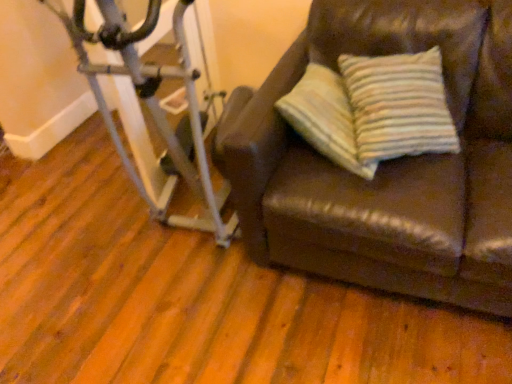
Question: Considering the relative sizes of brown leather couch at right and silver metallic stationary bicycle at left in the image provided, is brown leather couch at right bigger than silver metallic stationary bicycle at left?

Choices:
 (A) yes
 (B) no

Answer: (A)

Question: Is brown leather couch at right oriented towards silver metallic stationary bicycle at left?

Choices:
 (A) yes
 (B) no

Answer: (B)

Question: Is brown leather couch at right completely or partially outside of silver metallic stationary bicycle at left?

Choices:
 (A) yes
 (B) no

Answer: (A)

Question: Considering the relative sizes of brown leather couch at right and silver metallic stationary bicycle at left in the image provided, is brown leather couch at right thinner than silver metallic stationary bicycle at left?

Choices:
 (A) no
 (B) yes

Answer: (B)

Question: Is silver metallic stationary bicycle at left located within brown leather couch at right?

Choices:
 (A) no
 (B) yes

Answer: (A)

Question: From the image's perspective, is brown leather couch at right located beneath silver metallic stationary bicycle at left?

Choices:
 (A) no
 (B) yes

Answer: (B)

Question: Can you confirm if silver metallic stationary bicycle at left is positioned to the right of brown leather couch at right?

Choices:
 (A) yes
 (B) no

Answer: (B)

Question: Can you confirm if silver metallic stationary bicycle at left is thinner than brown leather couch at right?

Choices:
 (A) yes
 (B) no

Answer: (B)

Question: Is silver metallic stationary bicycle at left next to brown leather couch at right and touching it?

Choices:
 (A) yes
 (B) no

Answer: (B)

Question: Considering the relative sizes of silver metallic stationary bicycle at left and brown leather couch at right in the image provided, is silver metallic stationary bicycle at left bigger than brown leather couch at right?

Choices:
 (A) no
 (B) yes

Answer: (A)

Question: Considering the relative positions of silver metallic stationary bicycle at left and brown leather couch at right in the image provided, is silver metallic stationary bicycle at left behind brown leather couch at right?

Choices:
 (A) yes
 (B) no

Answer: (A)

Question: Is silver metallic stationary bicycle at left looking in the opposite direction of brown leather couch at right?

Choices:
 (A) no
 (B) yes

Answer: (A)

Question: In the image, is silver metallic stationary bicycle at left positioned in front of or behind brown leather couch at right?

Choices:
 (A) front
 (B) behind

Answer: (B)